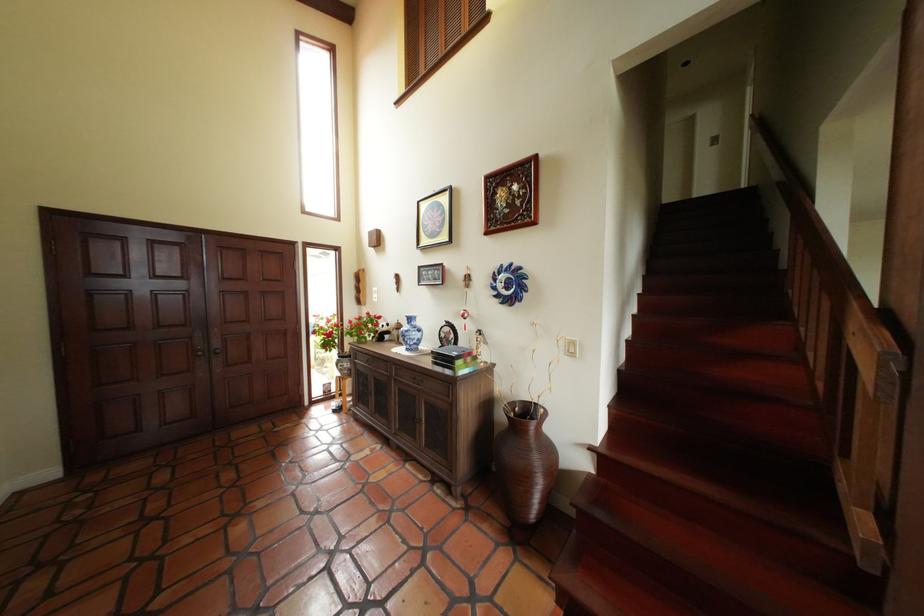
This screenshot has height=616, width=924. Find the location of `white light switch`. white light switch is located at coordinates (572, 347).